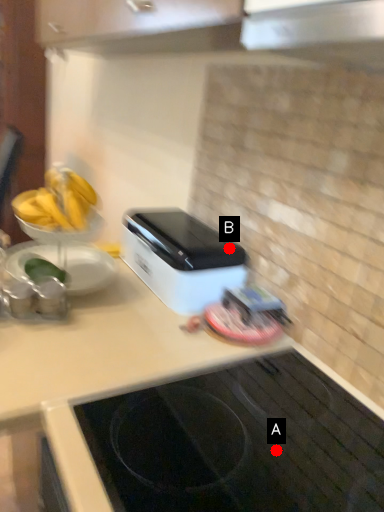
Question: Two points are circled on the image, labeled by A and B beside each circle. Which point appears closest to the camera in this image?

Choices:
 (A) A is closer
 (B) B is closer

Answer: (A)